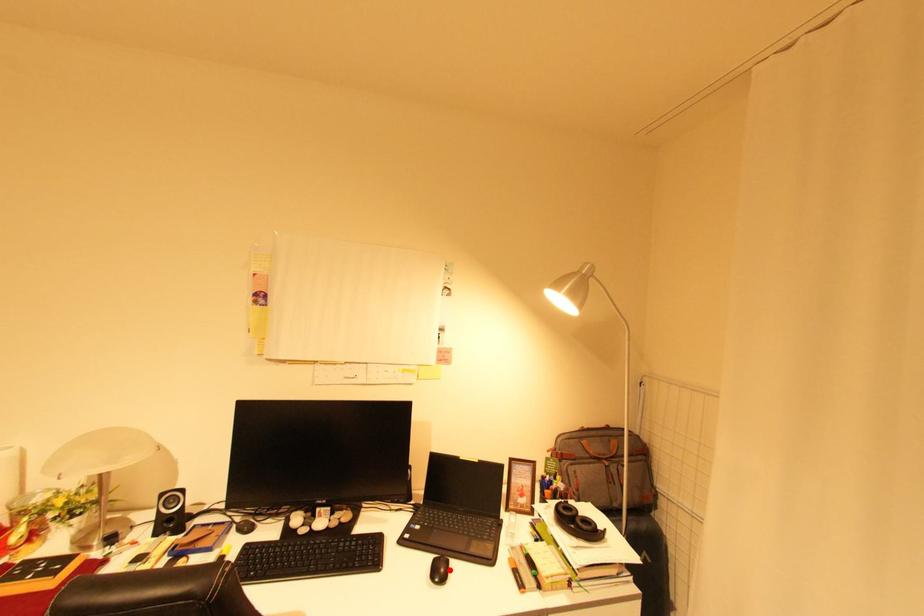
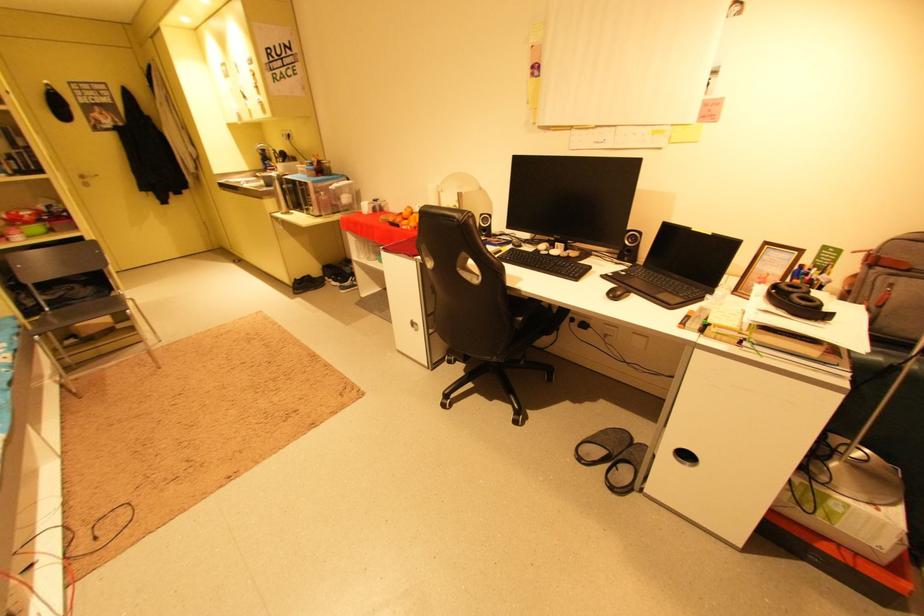
The point at the highlighted location is marked in the first image. Where is the corresponding point in the second image?

(627, 294)